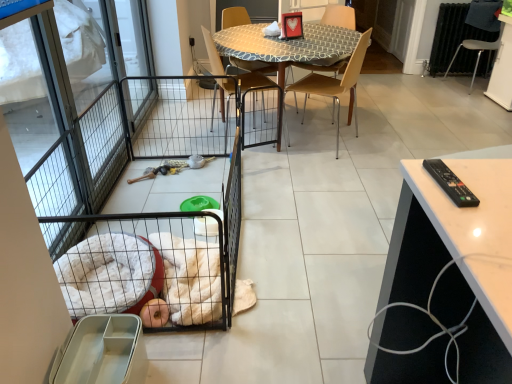
Where is `free point in front of light brown plastic chair at center, which appears as the second chair when viewed from the left`? free point in front of light brown plastic chair at center, which appears as the second chair when viewed from the left is located at coordinates (328, 161).